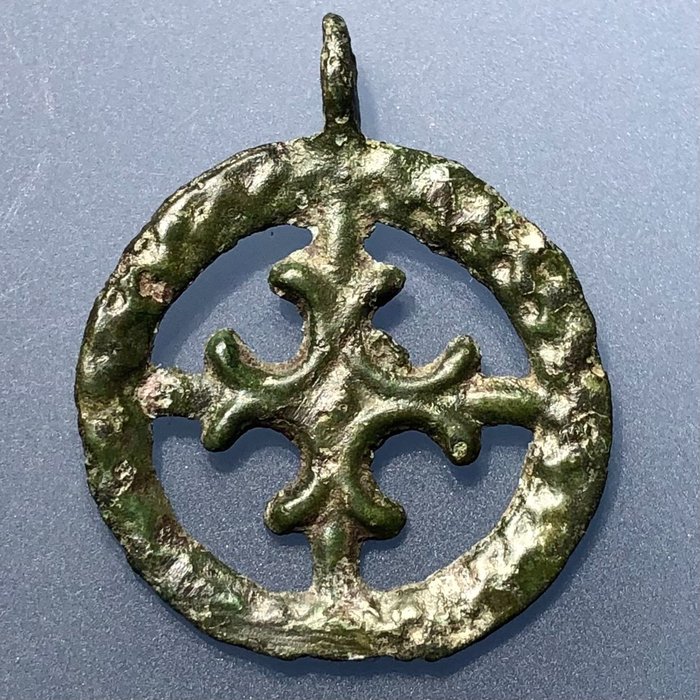
Image resolution: width=700 pixels, height=700 pixels. Find the location of `light`. light is located at coordinates (508, 550).